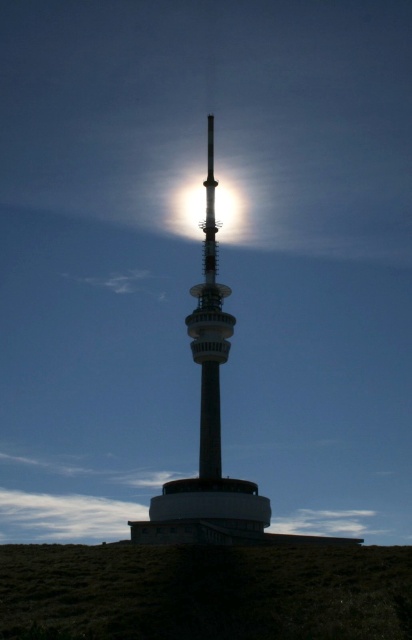
You are a maintenance worker needing to reach the silvery metallic tower at center from the green grassy hillside at lower center. Given that your ladder is 15 meters long, will it be sufficient to bridge the gap between them?

The distance between the green grassy hillside at lower center and the silvery metallic tower at center is 15.46 meters. Since the ladder is only 15 meters long, it is 0.46 meters too short to bridge the gap. A longer ladder or alternative equipment would be needed.

You are standing on the green grassy hillside at lower center and want to walk to the bright metallic tower at center. Which direction should you head to reach it?

Since the green grassy hillside at lower center is positioned on the left side of the bright metallic tower at center, you should head to the right to reach the tower.

You are a maintenance worker standing at the base of the silvery metallic tower at center. Your supervisor has instructed you to climb the tower to inspect the antenna at the top. Given that the tower is 115.47 meters tall, and you have a safety harness rated for 120 meters, is your harness sufficient for this task?

The silvery metallic tower at center is 115.47 meters tall. Since your safety harness is rated for 120 meters, it is sufficient for the task as it exceeds the tower height by 4.53 meters.